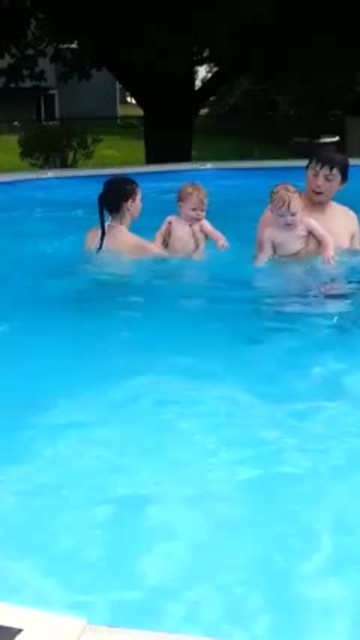
Question: Can you confirm if smooth skin baby at upper right is thinner than smooth skin baby at center?

Choices:
 (A) no
 (B) yes

Answer: (B)

Question: Can you confirm if smooth skin baby at upper right is wider than blonde hair baby at center?

Choices:
 (A) yes
 (B) no

Answer: (A)

Question: Does smooth skin baby at upper right appear under blonde hair baby at center?

Choices:
 (A) no
 (B) yes

Answer: (A)

Question: Which point is closer to the camera?

Choices:
 (A) smooth skin baby at upper right
 (B) blonde hair baby at center

Answer: (B)

Question: Which is nearer to the smooth skin baby at center?

Choices:
 (A) smooth skin baby at upper right
 (B) blonde hair baby at center

Answer: (B)

Question: Which point is farther to the camera?

Choices:
 (A) smooth skin baby at upper right
 (B) blonde hair baby at center
 (C) smooth skin baby at center

Answer: (C)